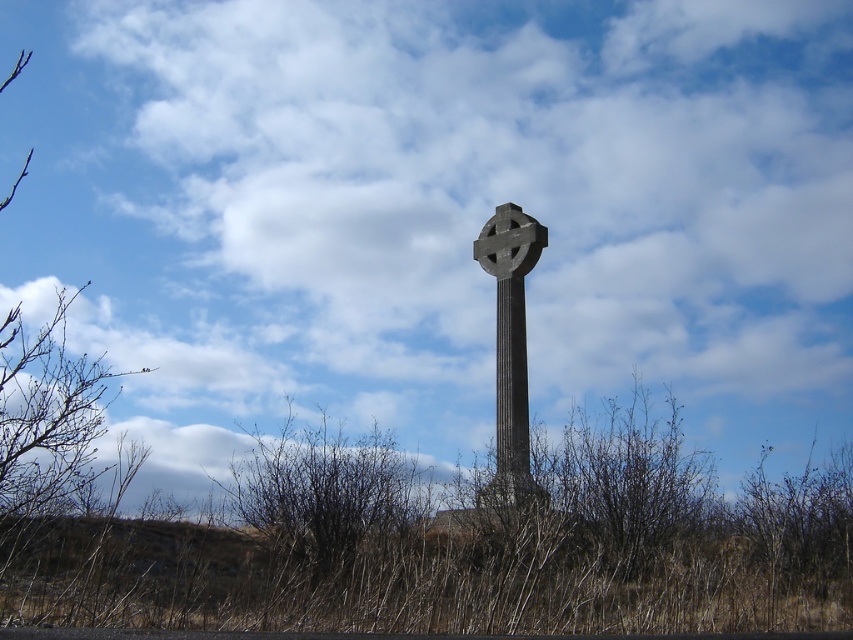
You are a gardener who needs to water the brown dry grass at center and brown dry grass at lower center. Which area should you water first if you want to start from the highest point and move downward?

The brown dry grass at lower center is higher than the brown dry grass at center, so you should start watering the brown dry grass at lower center first before moving down to the brown dry grass at center.

You are standing in front of the stone cross and want to place two markers at the coordinates point [317,524] and point [500,209]. Which marker will appear closer to you when viewed from your current position?

Point [317,524] is closer to the camera than point [500,209], so the marker at point [317,524] will appear closer to you.

You are standing at the base of the stone cross and want to place a small decoration on the brown dry grass at lower center. According to the coordinates provided, where exactly should you place it?

The brown dry grass at lower center is located at point (328, 497), so you should place the decoration at those coordinates.